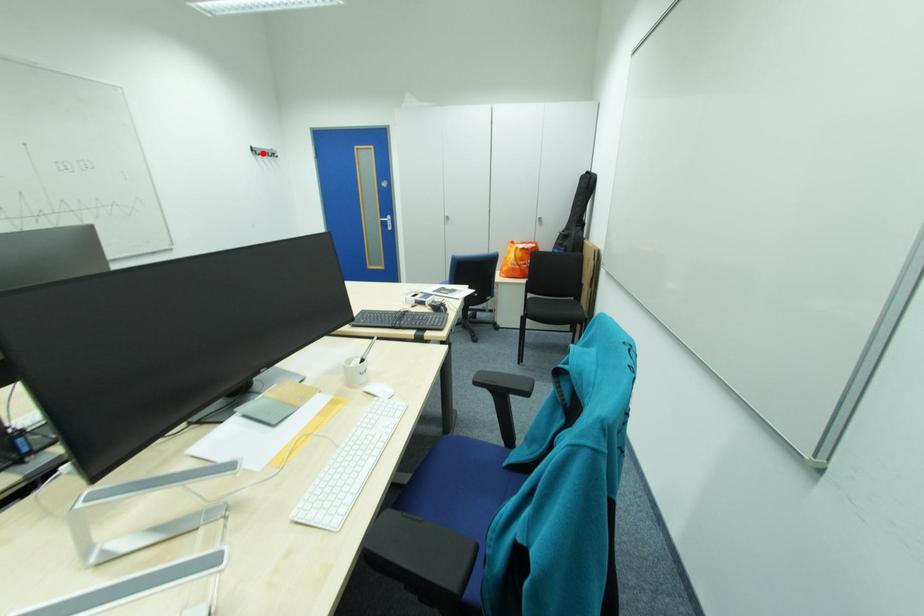
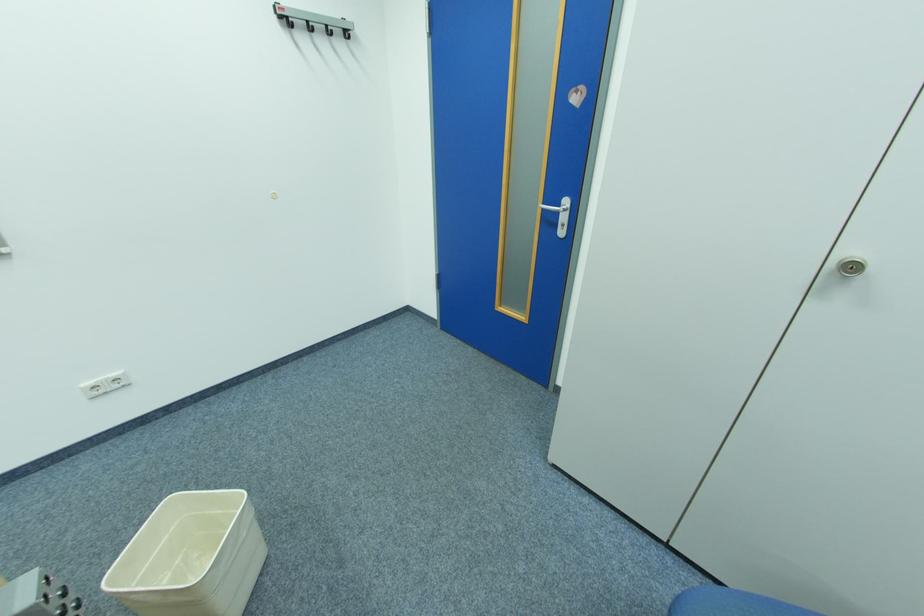
In the second image, find the point that corresponds to the highlighted location in the first image.

(290, 25)